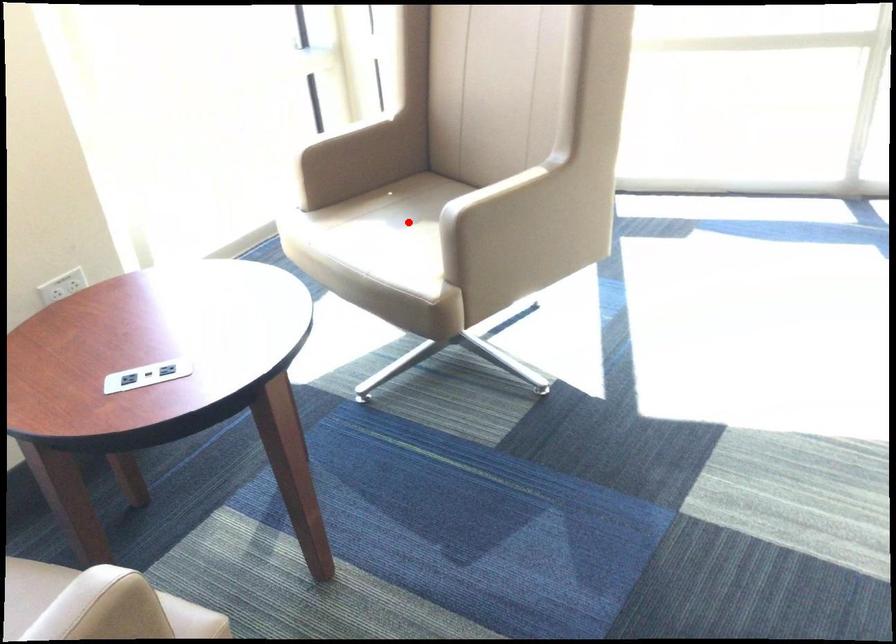
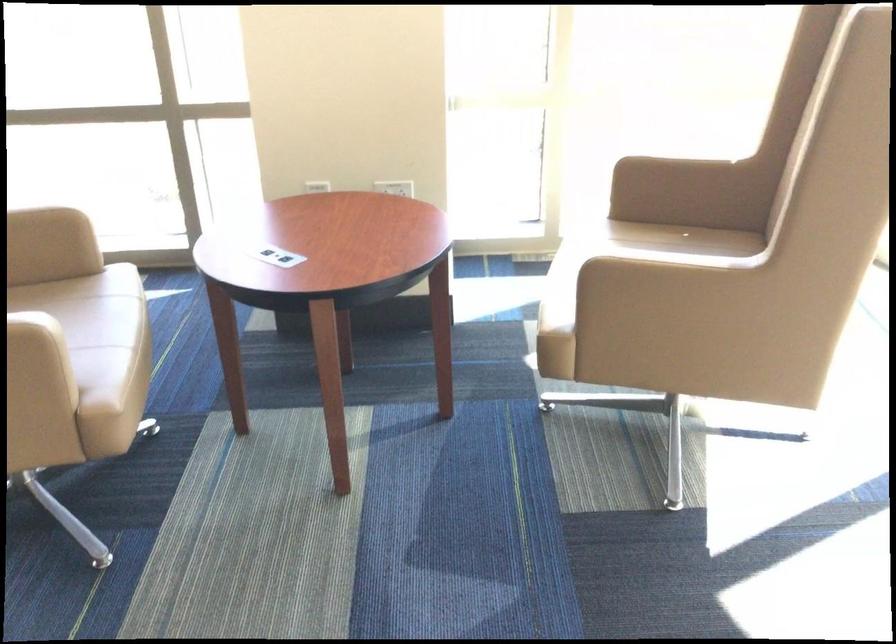
Question: I am providing you with two images of the same scene from different viewpoints. A red point is marked on the first image. Can you still see the location of the red point in image 2?

Choices:
 (A) Yes
 (B) No

Answer: (B)